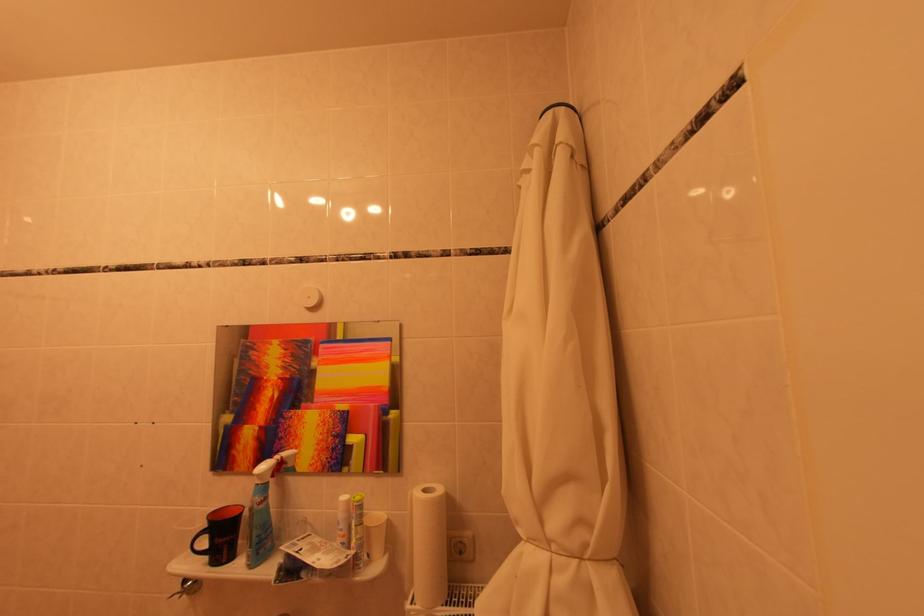
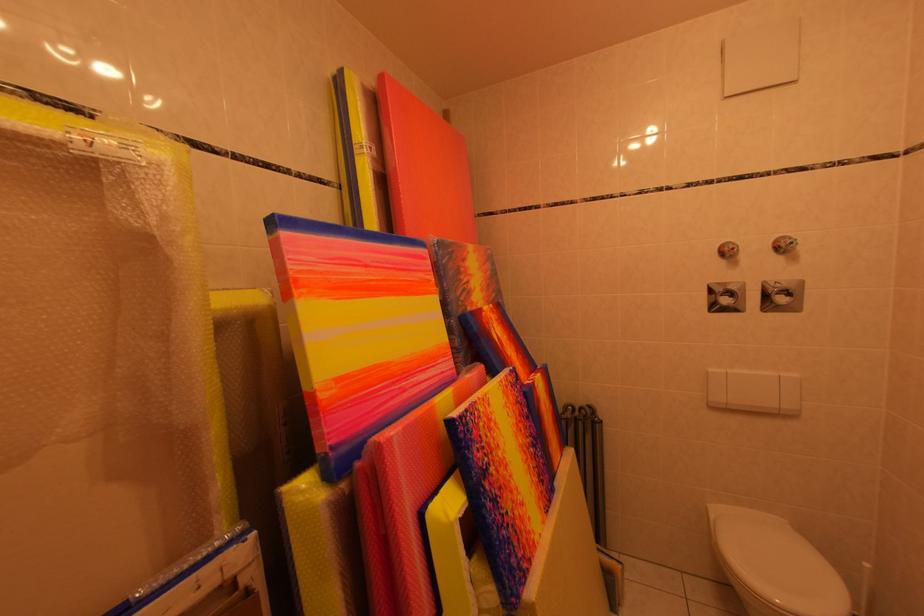
Question: Based on the continuous images, in which direction is the camera rotating? Reply with the corresponding letter.

Choices:
 (A) Left
 (B) Right
 (C) Up
 (D) Down

Answer: (A)